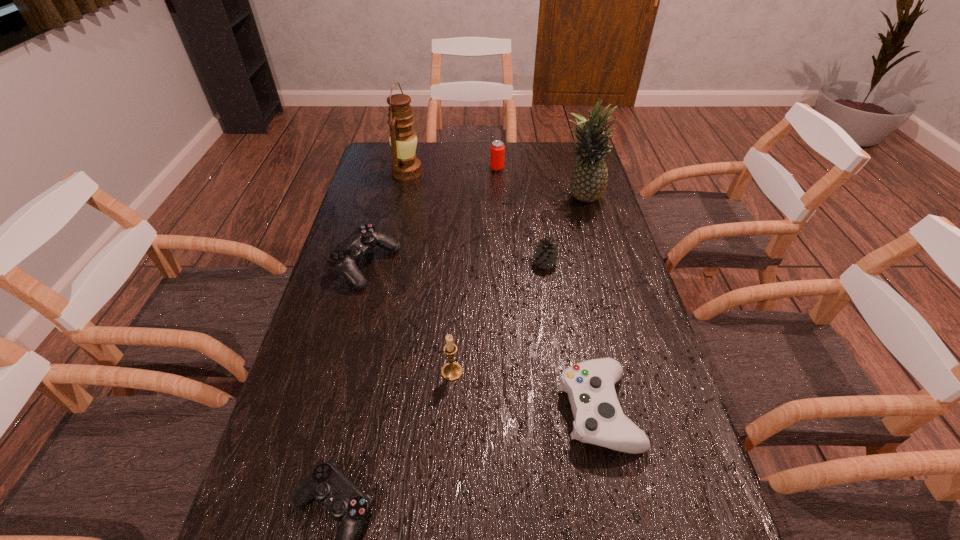
Locate an element on the screen. The image size is (960, 540). vacant space that satisfies the following two spatial constraints: 1. on the front side of the oil lamp; 2. on the right side of the brown pinecone is located at coordinates (388, 263).